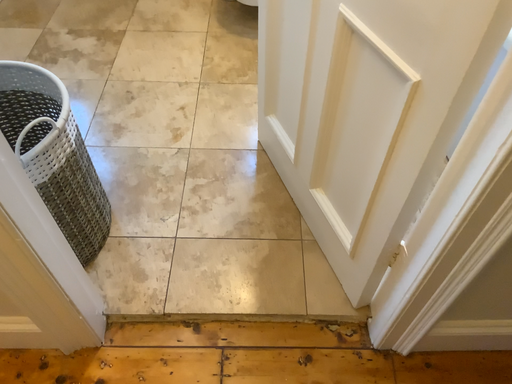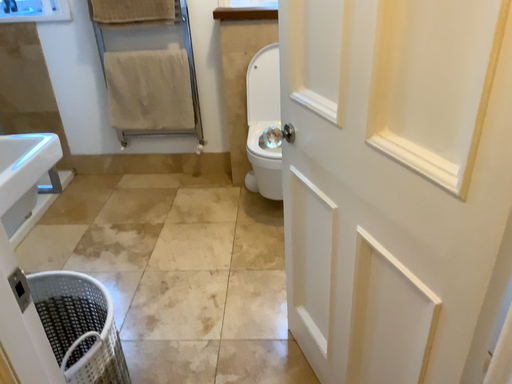
Question: How did the camera likely rotate when shooting the video?

Choices:
 (A) rotated downward
 (B) rotated upward

Answer: (B)